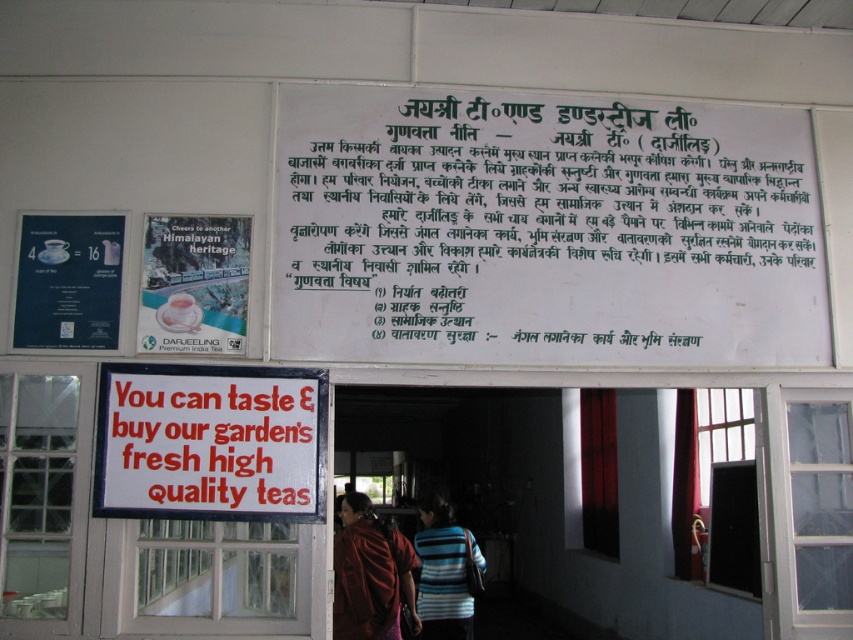
Question: Which point is closer to the camera?

Choices:
 (A) (460, 547)
 (B) (645, 202)
 (C) (241, 323)

Answer: (C)

Question: Does matte red blouse at center appear over striped fabric sweater at center?

Choices:
 (A) yes
 (B) no

Answer: (A)

Question: Can you confirm if matte black cup at upper left is bigger than matte red blouse at center?

Choices:
 (A) yes
 (B) no

Answer: (B)

Question: Does white matte sign at center lie behind matte black cup at upper left?

Choices:
 (A) yes
 (B) no

Answer: (B)

Question: Which point is farther to the camera?

Choices:
 (A) (68, 340)
 (B) (195, 342)
 (C) (403, 573)

Answer: (C)

Question: Among these objects, which one is farthest from the camera?

Choices:
 (A) matte red blouse at center
 (B) white matte sign at center
 (C) white paper poster at upper center

Answer: (A)